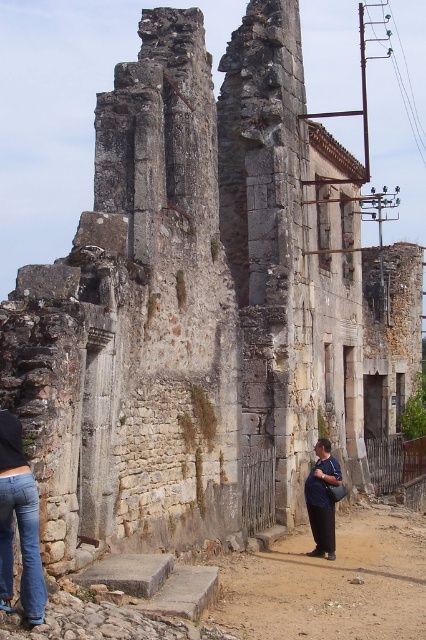
Question: Which object appears closest to the camera in this image?

Choices:
 (A) dark blue jeans at lower center
 (B) denim jeans at lower left

Answer: (B)

Question: Is brown dirt path at lower center below denim jeans at lower left?

Choices:
 (A) yes
 (B) no

Answer: (A)

Question: Does brown dirt path at lower center have a larger size compared to denim jeans at lower left?

Choices:
 (A) no
 (B) yes

Answer: (B)

Question: Which point is farther to the camera?

Choices:
 (A) (2, 483)
 (B) (321, 534)

Answer: (B)

Question: Which point is closer to the camera taking this photo?

Choices:
 (A) (5, 474)
 (B) (305, 484)

Answer: (A)

Question: Can you confirm if brown dirt path at lower center is positioned to the left of dark blue jeans at lower center?

Choices:
 (A) no
 (B) yes

Answer: (A)